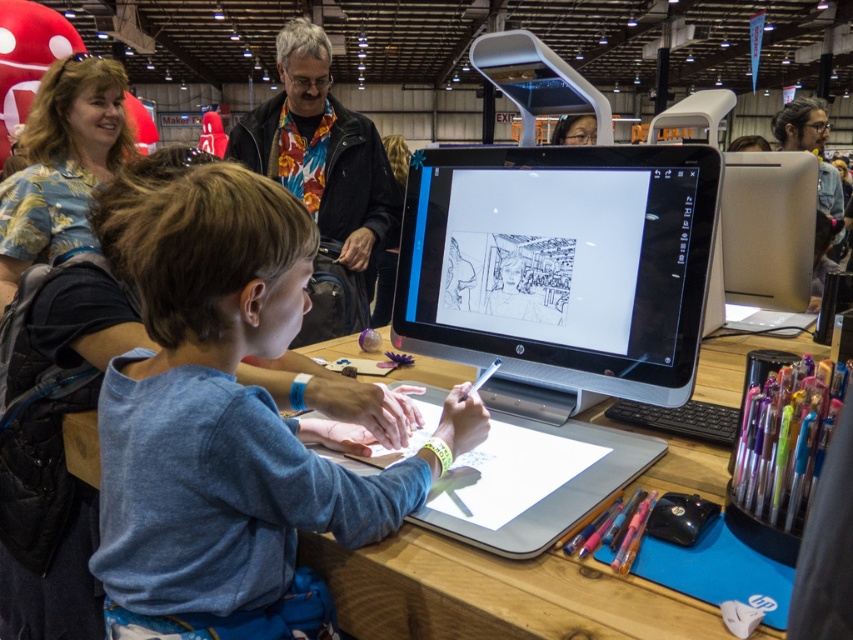
Can you confirm if blue cotton shirt at center is smaller than blue floral shirt at upper left?

Yes, blue cotton shirt at center is smaller than blue floral shirt at upper left.

In the scene shown: Is the position of blue cotton shirt at center more distant than that of blue floral shirt at upper left?

No.

At what (x,y) coordinates should I click in order to perform the action: click on blue cotton shirt at center. Please return your answer as a coordinate pair (x, y). This screenshot has width=853, height=640. Looking at the image, I should click on (229, 416).

Who is higher up, satin silver monitor at center or blue floral shirt at upper left?

Positioned higher is blue floral shirt at upper left.

Identify the location of satin silver monitor at center. (560, 262).

This screenshot has width=853, height=640. What are the coordinates of `satin silver monitor at center` in the screenshot? It's located at (560, 262).

Does blue cotton shirt at center appear under satin silver monitor at center?

Indeed, blue cotton shirt at center is positioned under satin silver monitor at center.

The height and width of the screenshot is (640, 853). What are the coordinates of `blue cotton shirt at center` in the screenshot? It's located at (229, 416).